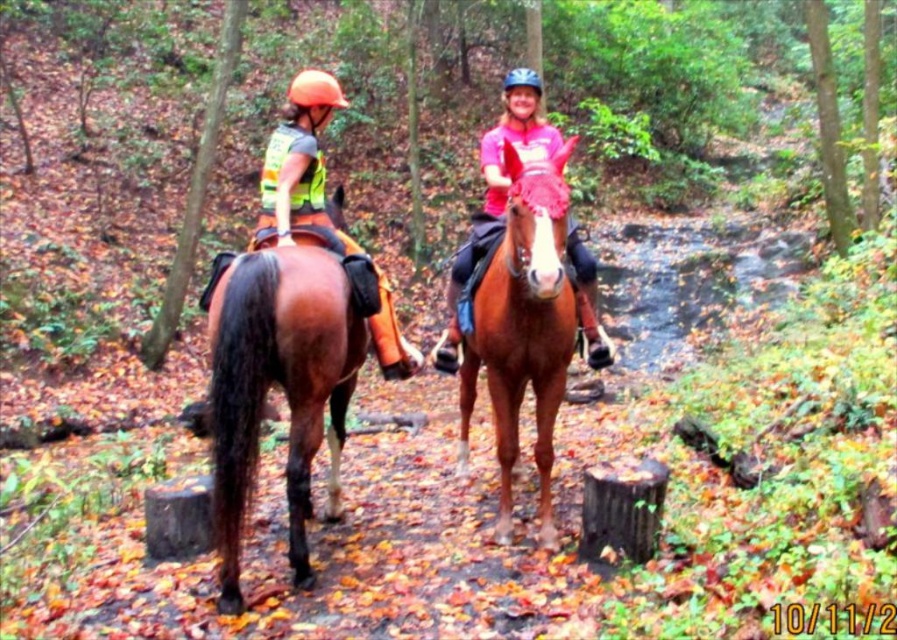
Question: Which object appears closest to the camera in this image?

Choices:
 (A) brown glossy horse at left
 (B) brown glossy horse at center

Answer: (B)

Question: Which point appears closest to the camera in this image?

Choices:
 (A) (231, 340)
 (B) (591, 266)

Answer: (A)

Question: Can you confirm if brown glossy horse at left is positioned to the left of brown glossy horse at center?

Choices:
 (A) yes
 (B) no

Answer: (A)

Question: Does brown glossy horse at left appear under brown glossy horse at center?

Choices:
 (A) yes
 (B) no

Answer: (A)

Question: Which of the following is the closest to the observer?

Choices:
 (A) (213, 484)
 (B) (511, 76)

Answer: (A)

Question: Does brown glossy horse at center appear on the left side of pink matte helmet at upper center?

Choices:
 (A) no
 (B) yes

Answer: (B)